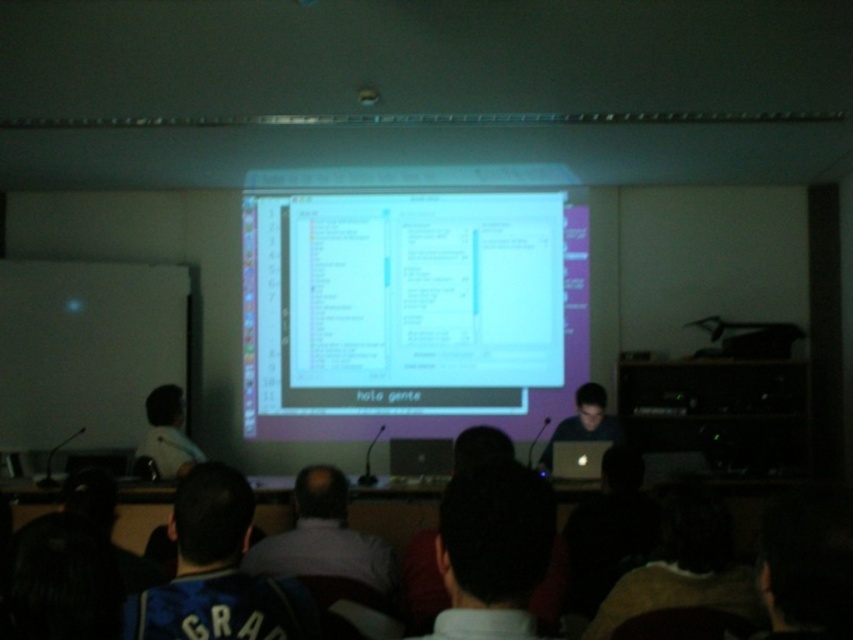
You are a presenter standing at the front of the room. You need to hand out a document to the person wearing the white matte shirt at center without leaving your position. The document is on your black matte laptop at center. Can you reach them directly, or do you need assistance?

The white matte shirt at center is 9.44 feet from the black matte laptop at center. Since the presenter is at the front and the laptop is at center, the distance is too far to reach directly. You will need assistance to hand over the document.

You are standing in the front of the room and want to see the white matte shirt at center. Where should you look relative to the screen?

The white matte shirt at center is located at the point 0.841 on the x axis and 0.380 on the y axis relative to the screen.

You are a presenter who needs to access your laptop during a presentation. You are standing in front of the white glossy projector screen at center. Can you reach the black matte laptop at center without moving past the screen?

The black matte laptop at center is behind the white glossy projector screen at center, so you can reach it without moving past the screen as it is positioned behind the screen.